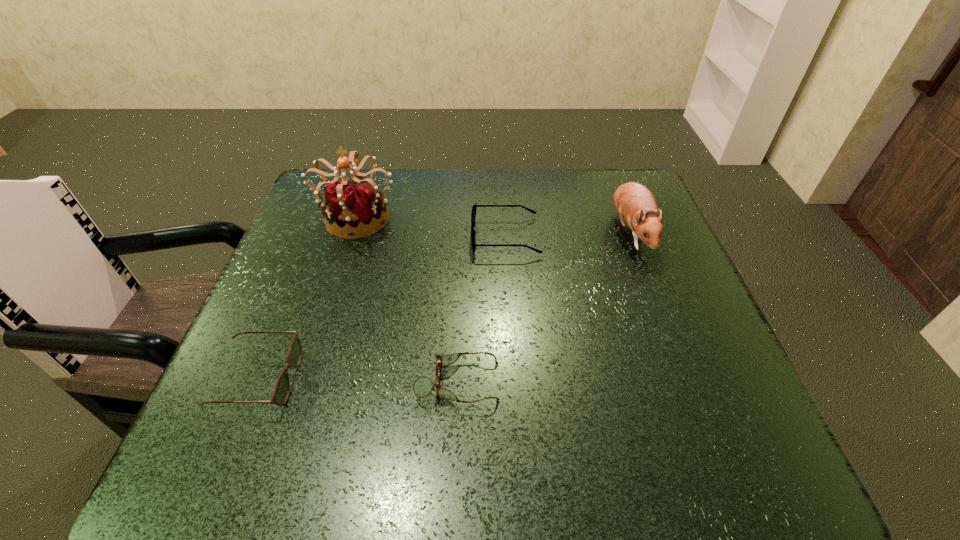
This screenshot has height=540, width=960. In order to click on free area in between the shortest spectacles and the rightmost object in this screenshot , I will do `click(543, 307)`.

The image size is (960, 540). I want to click on free spot between the leftmost spectacles and the shortest object, so click(x=358, y=381).

Locate an element on the screen. empty space between the tiara and the shortest spectacles is located at coordinates [408, 299].

What are the coordinates of `free spot between the leftmost spectacles and the fourth shortest object` in the screenshot? It's located at (444, 306).

Identify the location of vacant area that lies between the hamster and the shortest object. (543, 307).

I want to click on free space between the tallest object and the fourth shortest object, so click(x=493, y=224).

Image resolution: width=960 pixels, height=540 pixels. Find the location of `vacant region between the tiara and the shortest spectacles`. vacant region between the tiara and the shortest spectacles is located at coordinates (408, 299).

The height and width of the screenshot is (540, 960). I want to click on empty location between the rightmost object and the shortest spectacles, so click(x=543, y=307).

Point out which object is positioned as the second nearest to the leftmost spectacles. Please provide its 2D coordinates. Your answer should be formatted as a tuple, i.e. [(x, y)], where the tuple contains the x and y coordinates of a point satisfying the conditions above.

[(356, 205)]

At what (x,y) coordinates should I click in order to perform the action: click on object that is the third closest one to the farthest spectacles. Please return your answer as a coordinate pair (x, y). This screenshot has width=960, height=540. Looking at the image, I should click on (422, 387).